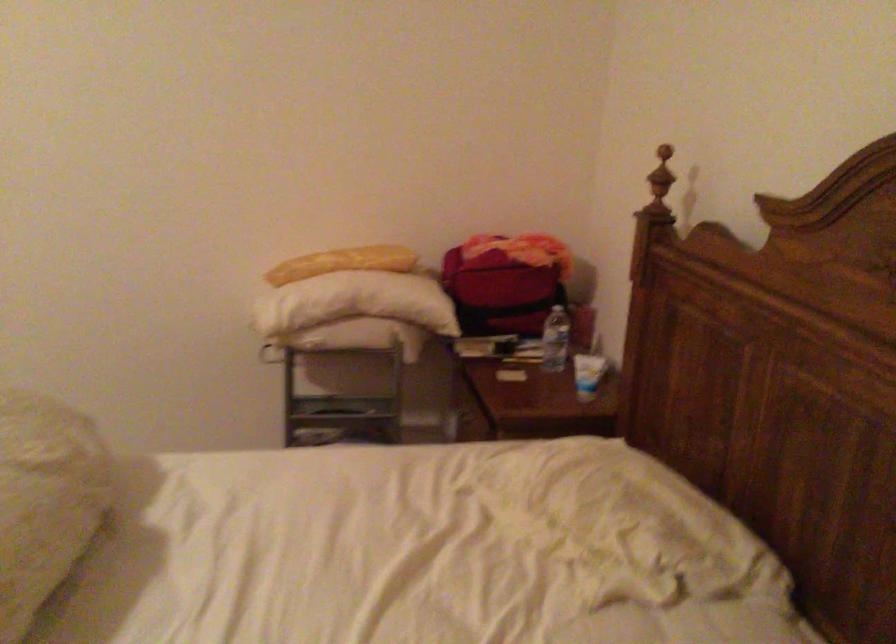
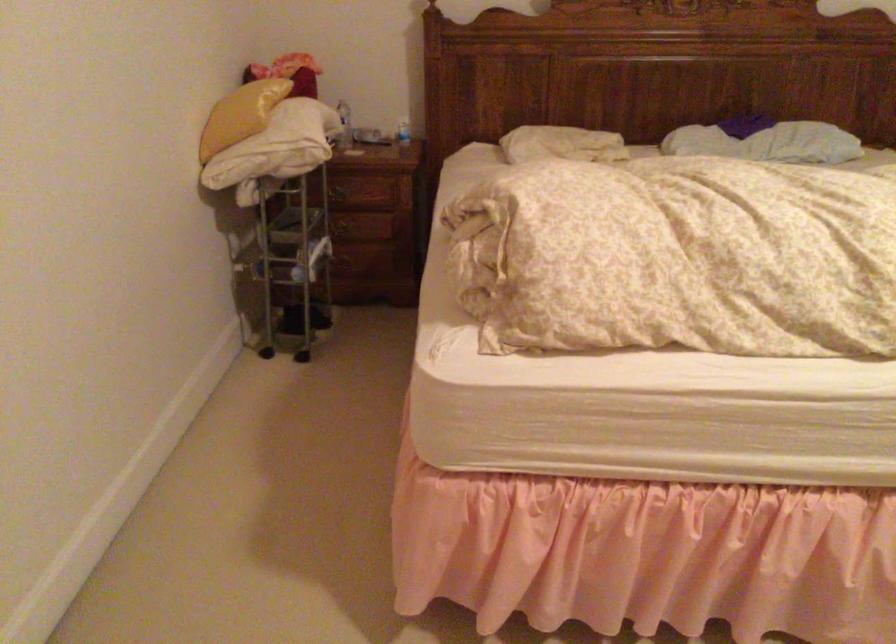
Find the pixel in the second image that matches point (291, 263) in the first image.

(240, 115)